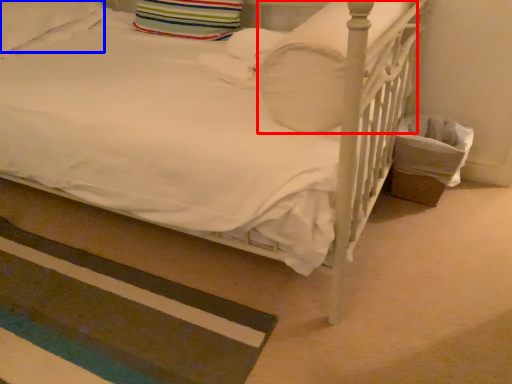
Question: Among these objects, which one is farthest to the camera, pillow (highlighted by a red box) or pillow (highlighted by a blue box)?

Choices:
 (A) pillow
 (B) pillow

Answer: (B)